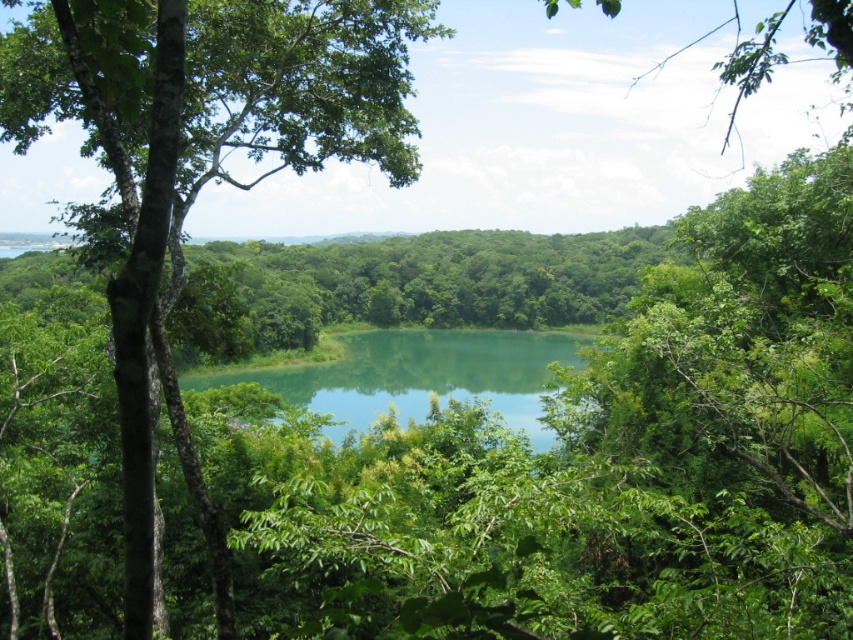
Question: From the image, what is the correct spatial relationship of green leafy tree at center in relation to green liquid at center?

Choices:
 (A) right
 (B) left

Answer: (B)

Question: Which point appears closest to the camera in this image?

Choices:
 (A) (425, 12)
 (B) (469, 362)

Answer: (A)

Question: Can you confirm if green leafy tree at center is positioned to the right of green liquid at center?

Choices:
 (A) yes
 (B) no

Answer: (B)

Question: Is green leafy tree at center behind green liquid at center?

Choices:
 (A) no
 (B) yes

Answer: (A)

Question: Among these points, which one is nearest to the camera?

Choices:
 (A) (462, 348)
 (B) (96, 67)

Answer: (B)